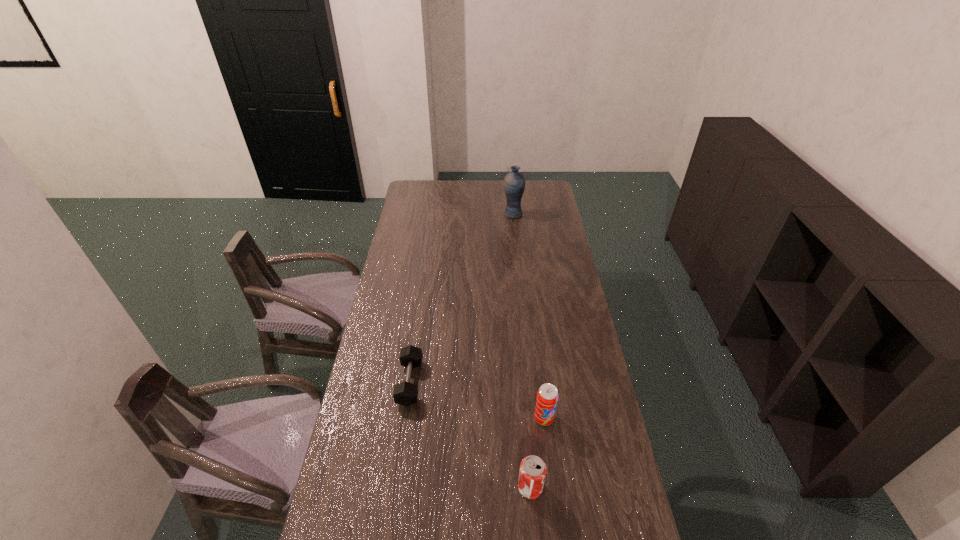
At what (x,y) coordinates should I click in order to perform the action: click on object at the left edge. Please return your answer as a coordinate pair (x, y). The image size is (960, 540). Looking at the image, I should click on (405, 393).

In order to click on vacant space at the far edge of the desktop in this screenshot , I will do `click(474, 187)`.

Image resolution: width=960 pixels, height=540 pixels. In the image, there is a desktop. In order to click on vacant space at the left edge in this screenshot , I will do `click(419, 274)`.

Where is `vacant point at the right edge`? The height and width of the screenshot is (540, 960). vacant point at the right edge is located at coordinates (563, 250).

The image size is (960, 540). In the image, there is a desktop. Find the location of `vacant space at the far left corner`. vacant space at the far left corner is located at coordinates (406, 196).

The width and height of the screenshot is (960, 540). Find the location of `unoccupied area between the third nearest object and the nearest object`. unoccupied area between the third nearest object and the nearest object is located at coordinates (470, 435).

This screenshot has width=960, height=540. What are the coordinates of `free spot between the shortest object and the third farthest object` in the screenshot? It's located at (477, 400).

Where is `free space between the farther soda can and the shortest object`? This screenshot has width=960, height=540. free space between the farther soda can and the shortest object is located at coordinates (477, 400).

Locate an element on the screen. The image size is (960, 540). vacant space that's between the farther soda can and the tallest object is located at coordinates (528, 316).

The height and width of the screenshot is (540, 960). I want to click on free space between the leftmost object and the farthest object, so [x=462, y=298].